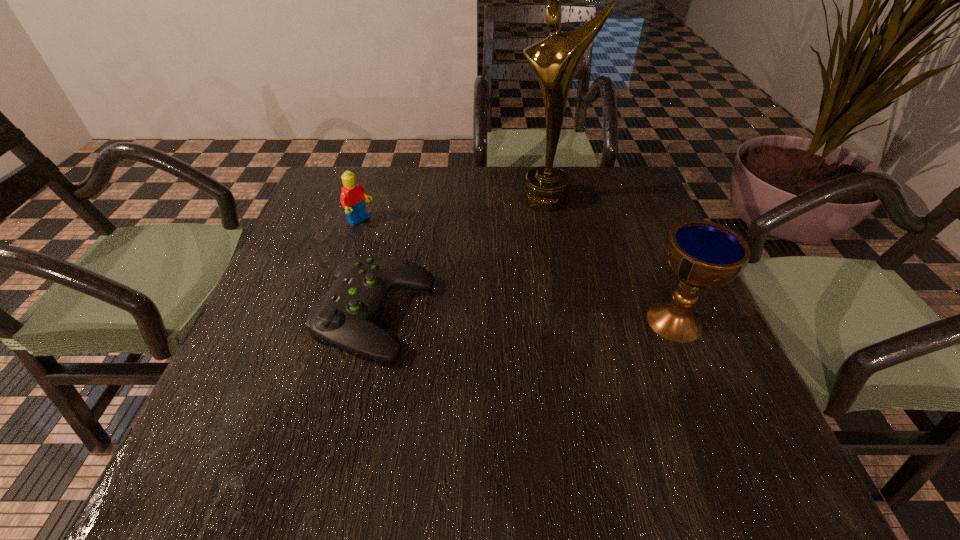
Find the location of a particular element. The width and height of the screenshot is (960, 540). object present at the far left corner is located at coordinates (352, 198).

The width and height of the screenshot is (960, 540). I want to click on vacant space at the far edge, so click(407, 183).

In order to click on free region at the near edge of the desktop in this screenshot , I will do click(x=394, y=389).

Where is `vacant position at the left edge of the desktop`? The image size is (960, 540). vacant position at the left edge of the desktop is located at coordinates (324, 250).

Find the location of a particular element. This screenshot has width=960, height=540. vacant space at the right edge of the desktop is located at coordinates (654, 238).

The height and width of the screenshot is (540, 960). What are the coordinates of `vacant space at the near left corner` in the screenshot? It's located at (271, 407).

This screenshot has height=540, width=960. In the image, there is a desktop. In order to click on vacant space at the far right corner in this screenshot , I will do `click(636, 170)`.

The image size is (960, 540). In order to click on free spot between the control and the chalice in this screenshot , I will do `click(525, 318)`.

Find the location of a particular element. vacant area between the second object from right to left and the rightmost object is located at coordinates (611, 260).

In order to click on free spot between the third nearest object and the rightmost object in this screenshot , I will do `click(517, 272)`.